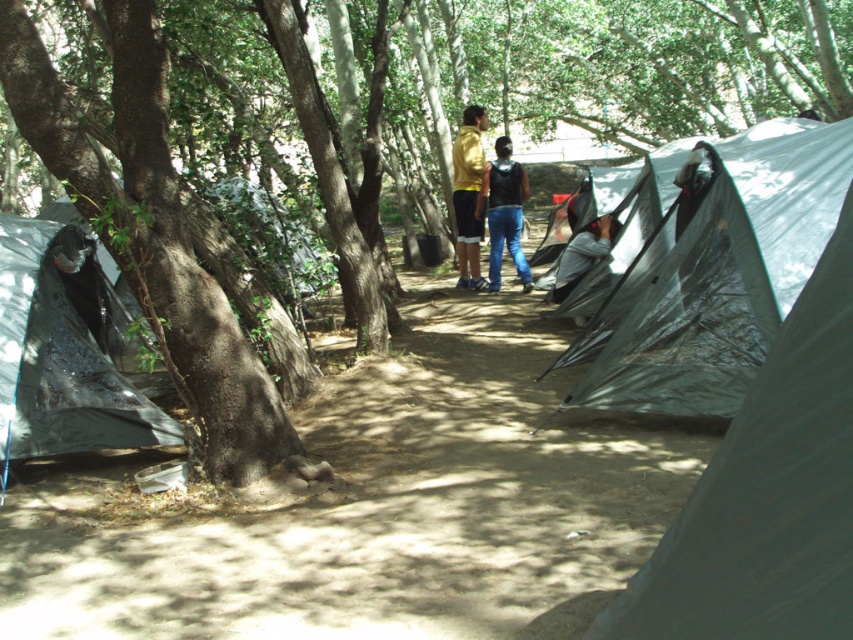
Question: Which of the following is the farthest from the observer?

Choices:
 (A) gray matte tent at center
 (B) black matte vest at center

Answer: (B)

Question: Which point is farther to the camera?

Choices:
 (A) gray matte tent at center
 (B) green rough bark tree at left
 (C) black tarp at lower left
 (D) transparent plastic tent at right

Answer: (A)

Question: Can you confirm if transparent plastic tent at right is bigger than black matte vest at center?

Choices:
 (A) no
 (B) yes

Answer: (B)

Question: Considering the real-world distances, which object is farthest from the gray matte tent at center?

Choices:
 (A) green rough bark tree at left
 (B) yellow matte jacket at center
 (C) black matte vest at center

Answer: (A)

Question: Can you confirm if black tarp at lower left is thinner than black matte vest at center?

Choices:
 (A) yes
 (B) no

Answer: (B)

Question: Observing the image, what is the correct spatial positioning of transparent plastic tent at right in reference to green rough bark tree at left?

Choices:
 (A) below
 (B) above

Answer: (A)